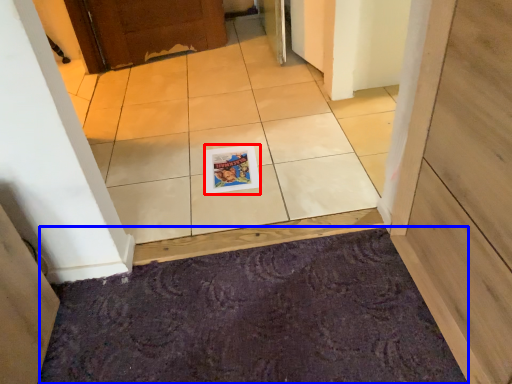
Question: Which of the following is the closest to the observer, magazine (highlighted by a red box) or doormat (highlighted by a blue box)?

Choices:
 (A) magazine
 (B) doormat

Answer: (B)